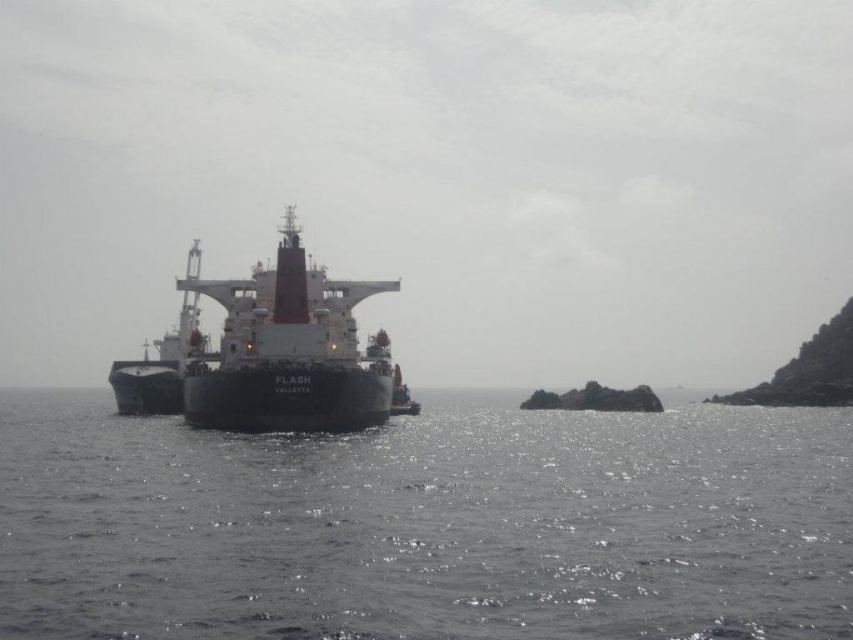
You are standing on the dock and see the glistening water at center and the white matte ship at center. Which object is positioned lower in the scene?

The glistening water at center is located below the white matte ship at center, so it is positioned lower in the scene.

You are a sailor standing on the deck of the white matte ship at center. You notice the glistening water at center. How does the height of the water compare to the ship?

The glistening water at center has a lesser height compared to the white matte ship at center, so the water is lower than the ship.